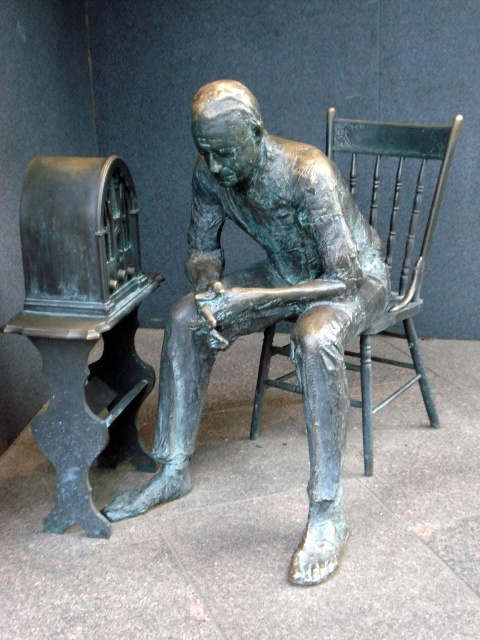
Find the location of a particular element. The width and height of the screenshot is (480, 640). bronze statue at center is located at coordinates (266, 301).

Is bronze statue at center wider than green wooden chair at center?

Yes.

Which is in front, point (171, 438) or point (400, 228)?

Positioned in front is point (171, 438).

Locate an element on the screen. bronze statue at center is located at coordinates (266, 301).